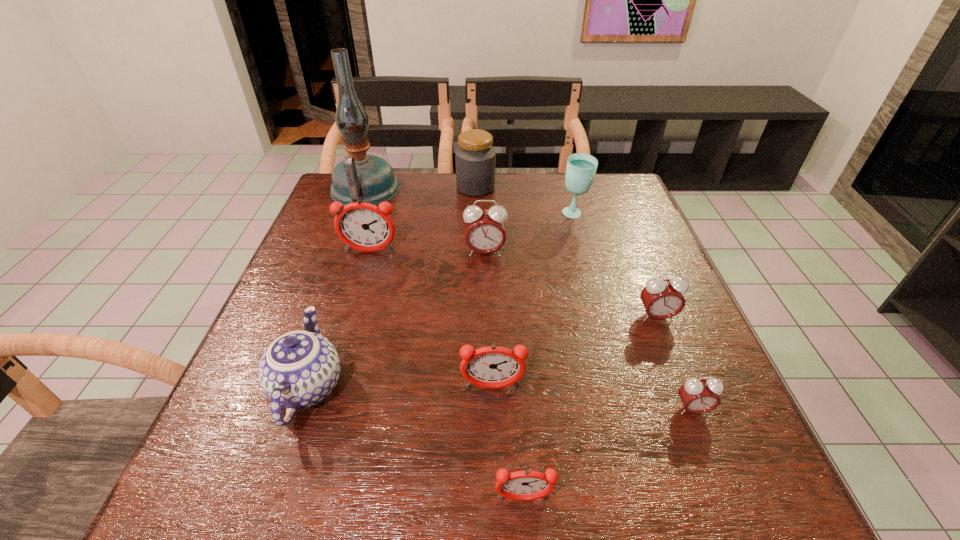
The height and width of the screenshot is (540, 960). What are the coordinates of `oil lamp` in the screenshot? It's located at (369, 178).

Where is `gray jar`? gray jar is located at coordinates (475, 157).

At what (x,y) coordinates should I click in order to perform the action: click on the eighth object from left to right. Please return your answer as a coordinate pair (x, y). This screenshot has width=960, height=540. Looking at the image, I should click on (581, 168).

Find the location of `the farthest pink alarm clock`. the farthest pink alarm clock is located at coordinates (485, 233).

Locate an element on the screen. This screenshot has width=960, height=540. the leftmost pink alarm clock is located at coordinates (485, 233).

At what (x,y) coordinates should I click in order to perform the action: click on the farthest reddish-pink alarm clock. Please return your answer as a coordinate pair (x, y). The width and height of the screenshot is (960, 540). Looking at the image, I should click on (363, 226).

Locate an element on the screen. Image resolution: width=960 pixels, height=540 pixels. the biggest reddish-pink alarm clock is located at coordinates (363, 226).

Where is `chinaware`? This screenshot has width=960, height=540. chinaware is located at coordinates (299, 369).

I want to click on the fourth nearest alarm clock, so click(662, 298).

Identify the location of the second smallest pink alarm clock. (662, 298).